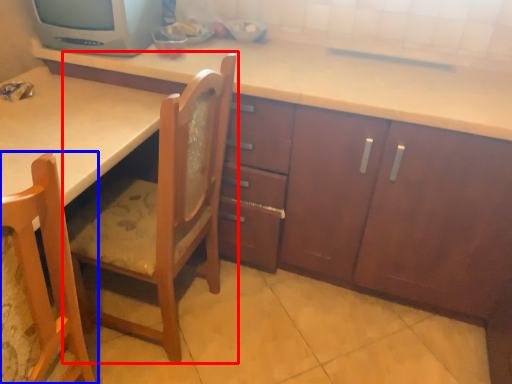
Question: Among these objects, which one is farthest to the camera, chair (highlighted by a red box) or chair (highlighted by a blue box)?

Choices:
 (A) chair
 (B) chair

Answer: (A)